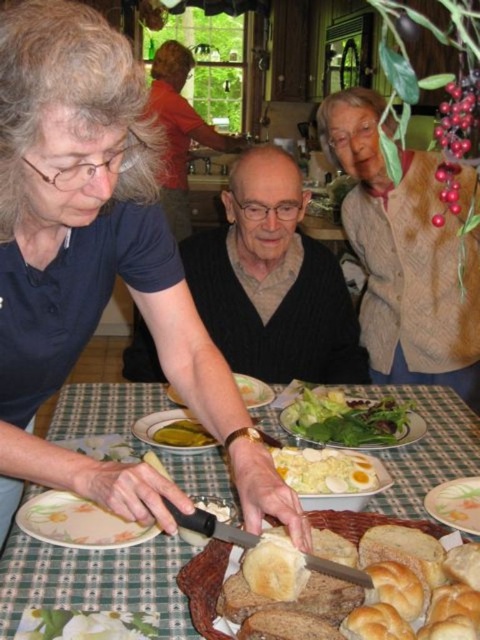
You are a guest at this dinner party and need to reach the golden brown bread at lower center. However, there is a dark gray sweater at center in the way. Can you move the sweater to access the bread?

The dark gray sweater at center is above the golden brown bread at lower center, so you can move the sweater to access the bread.

You are a chef preparing a meal and need to place a decorative plate between the wooden table at center and the green leafy salad at center. If the decorative plate has a diameter of 12 centimeters, will it fit in the space between them?

The distance between the wooden table at center and the green leafy salad at center is 13.97 centimeters. Since the decorative plate has a diameter of 12 centimeters, which is smaller than the available space, the plate will fit comfortably between them.